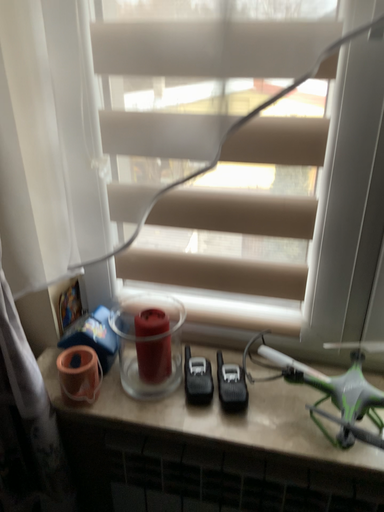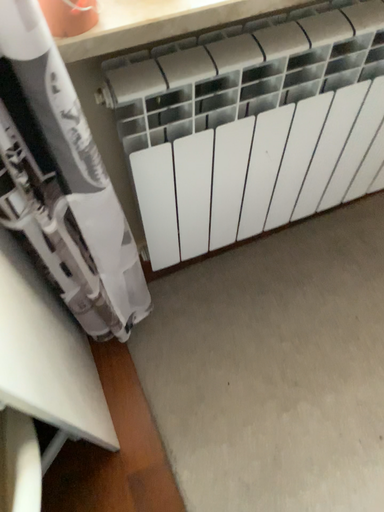
Question: Which way did the camera rotate in the video?

Choices:
 (A) rotated upward
 (B) rotated downward

Answer: (B)